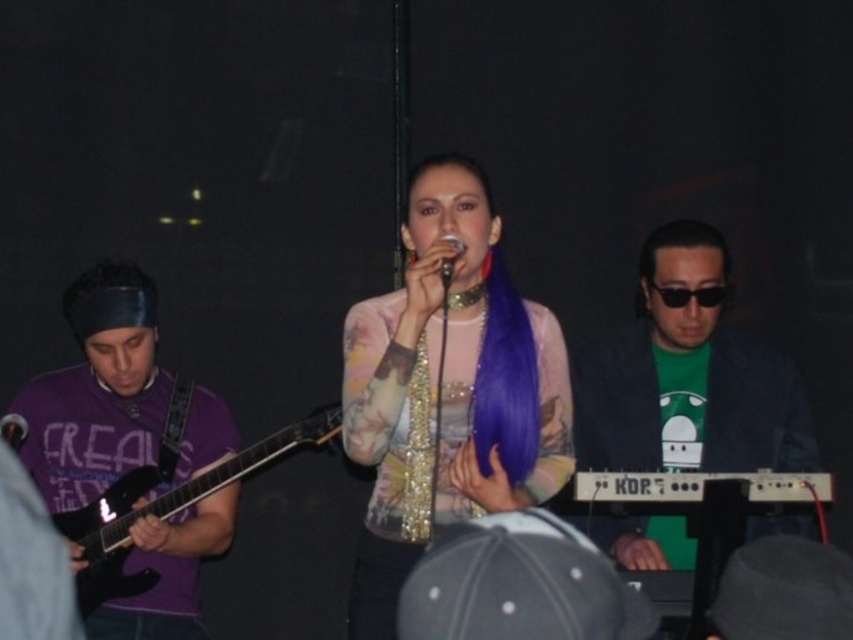
Question: Is green matte keyboard at right smaller than metallic silver microphone at center?

Choices:
 (A) no
 (B) yes

Answer: (A)

Question: Which of these objects is positioned farthest from the purple shiny hair at center?

Choices:
 (A) black glossy electric guitar at left
 (B) purple matte guitar at left
 (C) metallic silver microphone at center

Answer: (C)

Question: Can you confirm if purple matte guitar at left is positioned above metallic silver microphone at center?

Choices:
 (A) yes
 (B) no

Answer: (B)

Question: Which of the following is the farthest from the observer?

Choices:
 (A) (619, 337)
 (B) (119, 490)
 (C) (12, 448)
 (D) (74, 472)

Answer: (A)

Question: Which point is closer to the camera?

Choices:
 (A) (372, 557)
 (B) (28, 444)

Answer: (A)

Question: Is green matte keyboard at right further to camera compared to metallic shiny microphone at center?

Choices:
 (A) no
 (B) yes

Answer: (B)